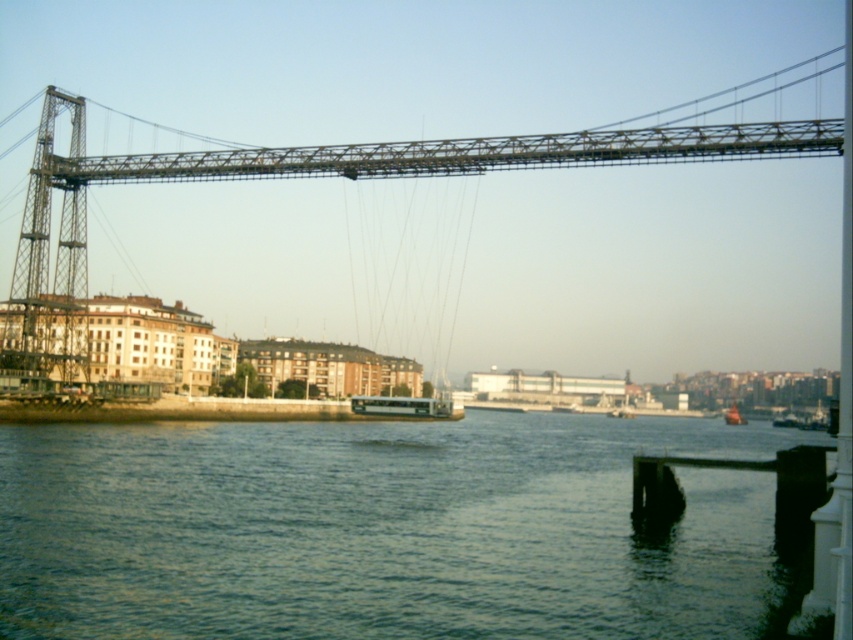
You are standing on the left bank of the waterfront and want to board a boat. Which boat, the white matte boat at center or the metallic orange boat at lower right, is taller and thus might offer better visibility of the suspension bridge?

The white matte boat at center is taller than the metallic orange boat at lower right, so it might offer better visibility of the suspension bridge.

You are standing at the waterfront and want to know how far the point at coordinates point (798, 144) is from you. Can you determine the distance?

The distance of point (798, 144) from viewer is 77.86 meters.

You are a photographer planning to capture the metallic gray suspension bridge at upper center and the metallic orange boat at lower right in a single frame. Considering their heights, which object will appear taller in the photograph?

The metallic gray suspension bridge at upper center will appear taller in the photograph since it has a greater height compared to the metallic orange boat at lower right.